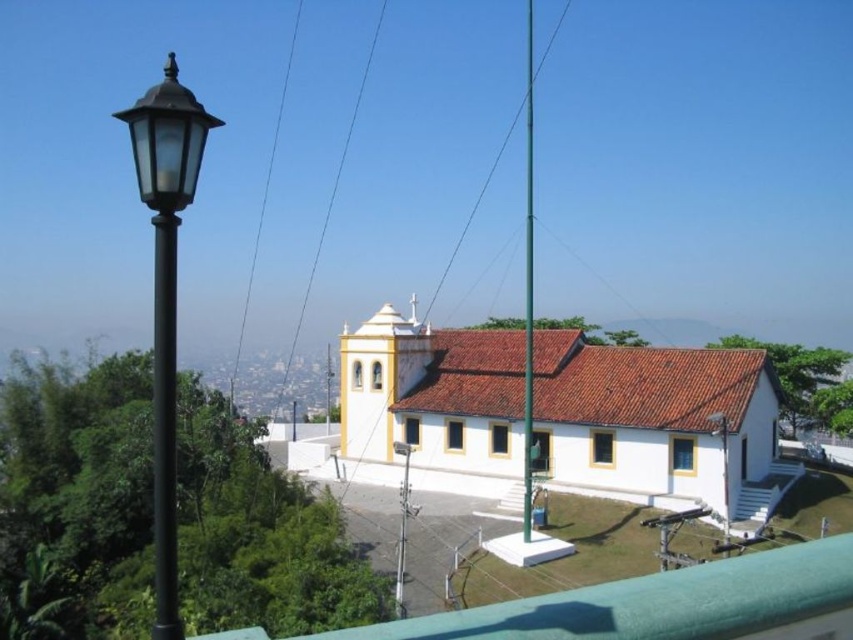
Based on the photo, measure the distance from black metal pole at left to matte black street light at upper left.

black metal pole at left is 76.58 feet away from matte black street light at upper left.

This screenshot has height=640, width=853. Describe the element at coordinates (164, 426) in the screenshot. I see `black metal pole at left` at that location.

The width and height of the screenshot is (853, 640). I want to click on black metal pole at left, so [164, 426].

The image size is (853, 640). Identify the location of black metal pole at left. (164, 426).

Which is behind, point (531, 460) or point (714, 419)?

The point (531, 460) is behind.

Which is more to the right, green metallic pole at center or matte black street light at upper left?

matte black street light at upper left is more to the right.

Find the location of a particular element. green metallic pole at center is located at coordinates (527, 289).

At what (x,y) coordinates should I click in order to perform the action: click on silver metallic street light at center. Please return your answer as a coordinate pair (x, y). Looking at the image, I should click on (401, 525).